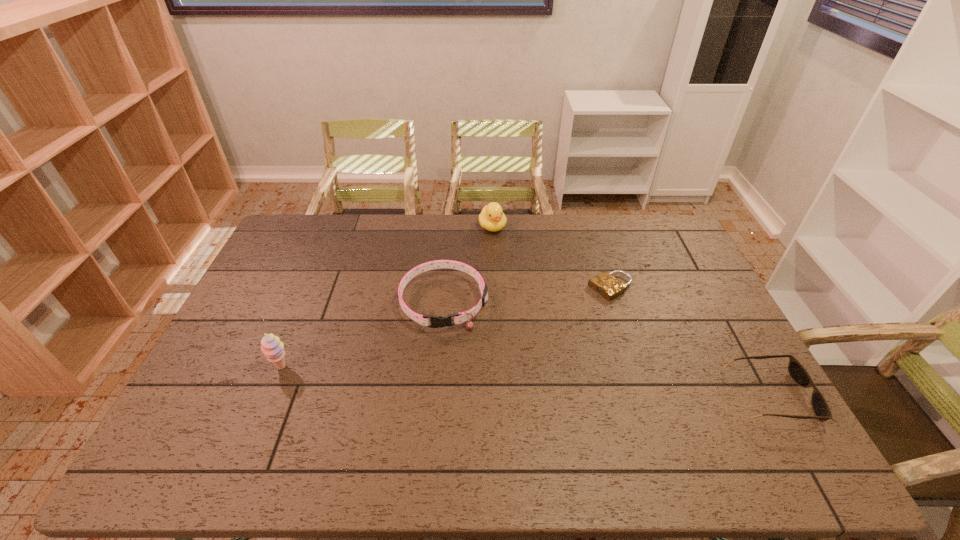
Identify the location of vacant space on the desktop that is between the leftmost object and the second shortest object and is positioned on the keyhole side of the padlock. The image size is (960, 540). (450, 377).

Locate an element on the screen. The height and width of the screenshot is (540, 960). free space on the desktop that is between the sherbert and the sunglasses and is positioned with the buckle on the dog collar is located at coordinates pos(446,377).

What are the coordinates of `vacant spot on the desktop that is between the tallest object and the rightmost object and is positioned on the beak of the farthest object` in the screenshot? It's located at (569, 384).